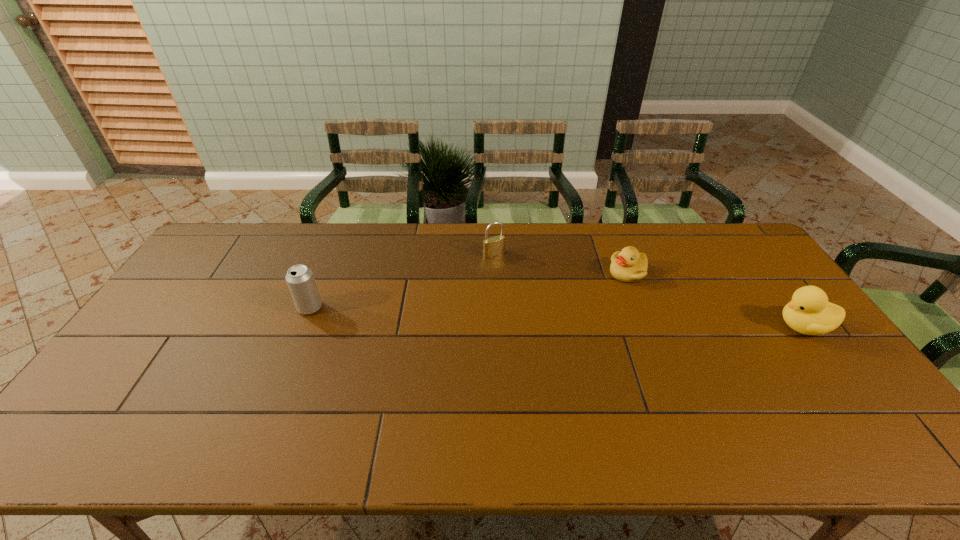
Locate an element on the screen. The image size is (960, 540). vacant space positioned 0.390m on the front-facing side of the farthest object is located at coordinates (564, 335).

Find the location of a particular element. vacant space located on the front-facing side of the farthest object is located at coordinates [536, 302].

Where is `blank space located on the front-facing side of the farthest object`? This screenshot has height=540, width=960. blank space located on the front-facing side of the farthest object is located at coordinates (529, 294).

Find the location of a particular element. The height and width of the screenshot is (540, 960). vacant space situated on the front-facing side of the third object from left to right is located at coordinates (x=582, y=329).

Where is `vacant space located on the front-facing side of the third object from left to right`? This screenshot has width=960, height=540. vacant space located on the front-facing side of the third object from left to right is located at coordinates (559, 357).

Identify the location of vacant space situated on the front-facing side of the third object from left to right. Image resolution: width=960 pixels, height=540 pixels. (569, 343).

I want to click on padlock located in the far edge section of the desktop, so click(493, 246).

Locate an element on the screen. Image resolution: width=960 pixels, height=540 pixels. duckling at the far edge is located at coordinates (628, 265).

Identify the location of object present at the right edge. Image resolution: width=960 pixels, height=540 pixels. click(809, 312).

The height and width of the screenshot is (540, 960). In order to click on free space at the far edge in this screenshot , I will do `click(520, 235)`.